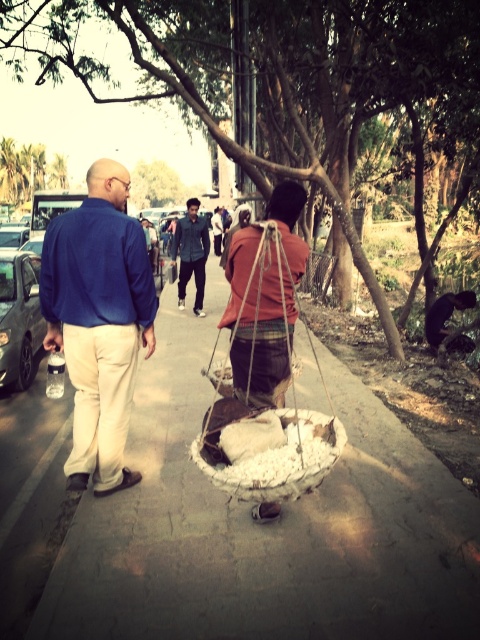
Question: Which is nearer to the denim jacket at center?

Choices:
 (A) matte blue shirt at center
 (B) shiny black jacket at center
 (C) concrete sidewalk at center

Answer: (B)

Question: Can you confirm if matte blue shirt at center is smaller than white woven basket at center?

Choices:
 (A) yes
 (B) no

Answer: (B)

Question: Which object appears farthest from the camera in this image?

Choices:
 (A) matte blue shirt at center
 (B) denim jacket at center
 (C) concrete sidewalk at center

Answer: (B)

Question: Is matte blue shirt at center positioned before denim jacket at center?

Choices:
 (A) yes
 (B) no

Answer: (A)

Question: Observing the image, what is the correct spatial positioning of concrete sidewalk at center in reference to matte blue shirt at center?

Choices:
 (A) right
 (B) left

Answer: (A)

Question: Which point is farther to the camera?

Choices:
 (A) (468, 305)
 (B) (176, 232)
 (C) (204, 376)
 (D) (84, 221)

Answer: (B)